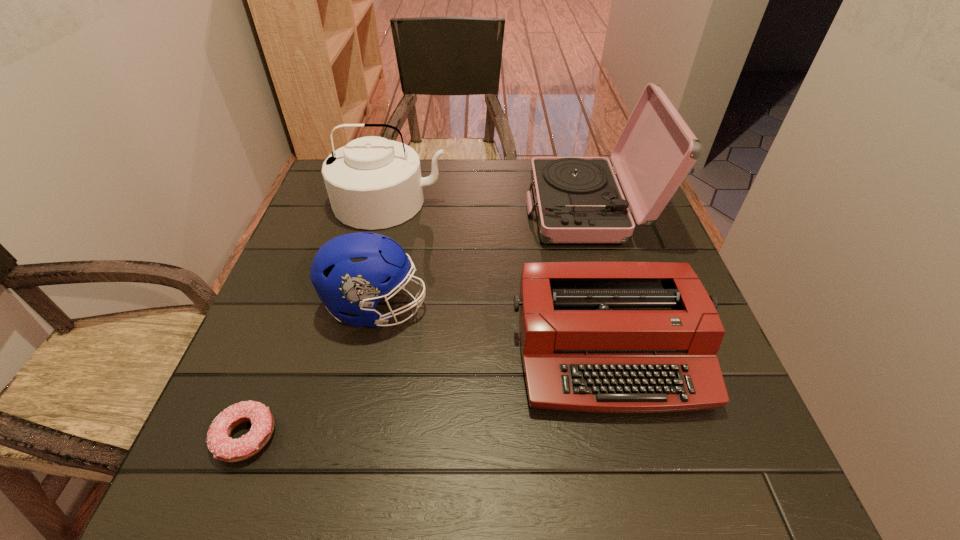
Locate an element on the screen. object located in the far left corner section of the desktop is located at coordinates 373,183.

Image resolution: width=960 pixels, height=540 pixels. I want to click on object located at the near left corner, so click(224, 448).

Locate an element on the screen. object present at the far right corner is located at coordinates (578, 200).

Locate an element on the screen. vacant space at the far edge is located at coordinates (473, 173).

Where is `vacant point at the near edge`? vacant point at the near edge is located at coordinates (440, 461).

Image resolution: width=960 pixels, height=540 pixels. In the image, there is a desktop. In order to click on vacant space at the left edge in this screenshot , I will do `click(231, 379)`.

Identify the location of free location at the right edge of the desktop. Image resolution: width=960 pixels, height=540 pixels. (690, 430).

In the image, there is a desktop. Where is `free space at the near right corner`? free space at the near right corner is located at coordinates (x=708, y=470).

This screenshot has height=540, width=960. Find the location of `empty space that is in between the record player and the shortest object`. empty space that is in between the record player and the shortest object is located at coordinates (x=417, y=322).

Image resolution: width=960 pixels, height=540 pixels. Find the location of `free space between the record player and the football helmet`. free space between the record player and the football helmet is located at coordinates (483, 258).